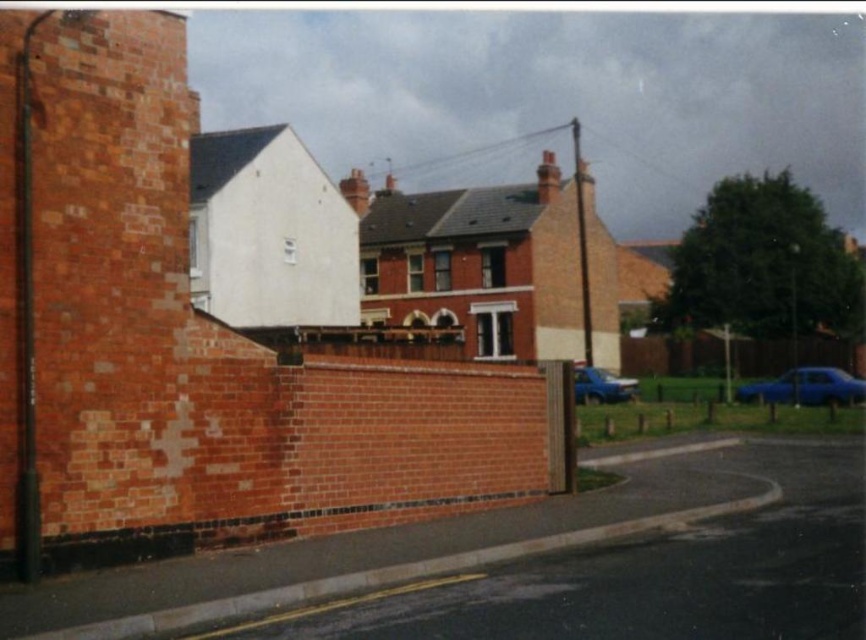
Question: Which object appears farthest from the camera in this image?

Choices:
 (A) blue metallic car at lower right
 (B) blue matte car at right

Answer: (B)

Question: Does blue matte car at right lie behind blue metallic car at lower right?

Choices:
 (A) yes
 (B) no

Answer: (A)

Question: Is blue matte car at right bigger than blue metallic car at lower right?

Choices:
 (A) yes
 (B) no

Answer: (B)

Question: Among these points, which one is farthest from the camera?

Choices:
 (A) (593, 380)
 (B) (816, 403)

Answer: (A)

Question: Can you confirm if blue matte car at right is positioned above blue metallic car at lower right?

Choices:
 (A) no
 (B) yes

Answer: (B)